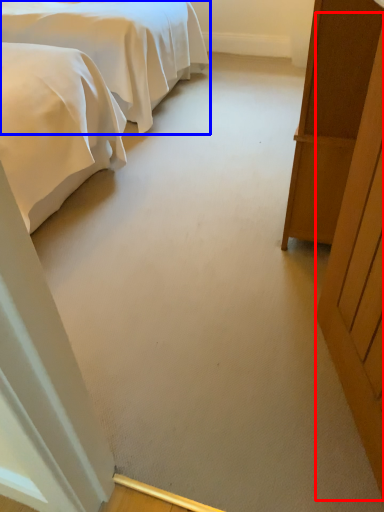
Question: Among these objects, which one is nearest to the camera, door (highlighted by a red box) or bed (highlighted by a blue box)?

Choices:
 (A) door
 (B) bed

Answer: (A)